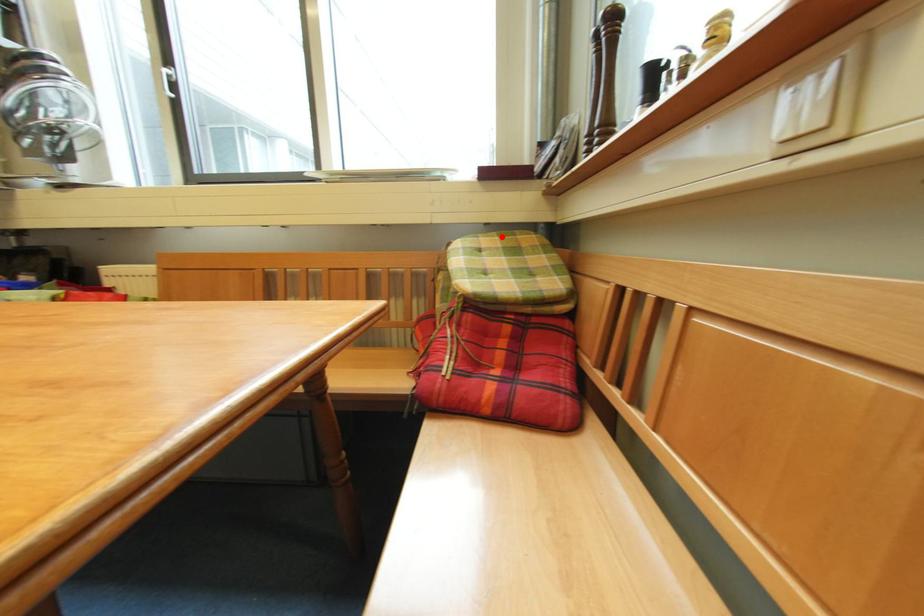
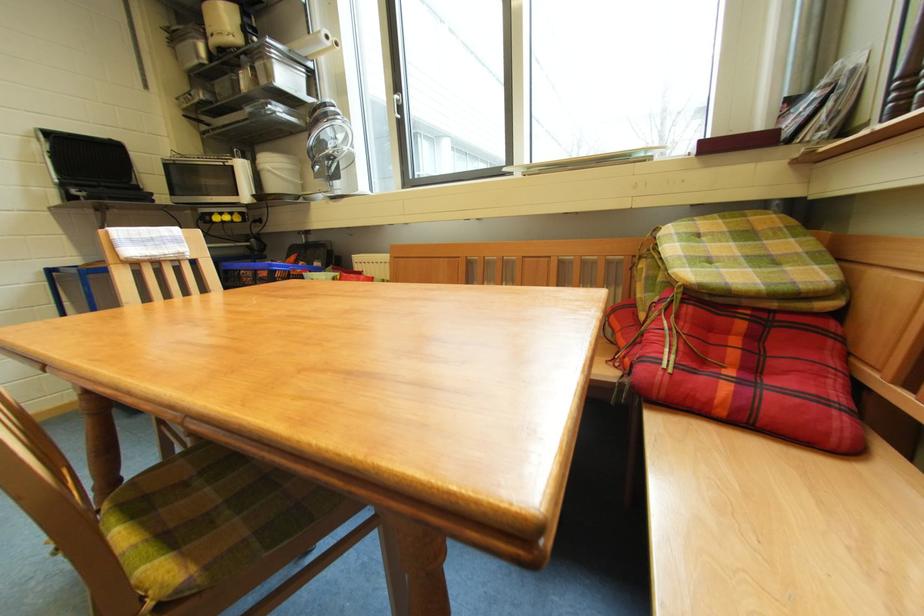
The point at the highlighted location is marked in the first image. Where is the corresponding point in the second image?

(723, 219)